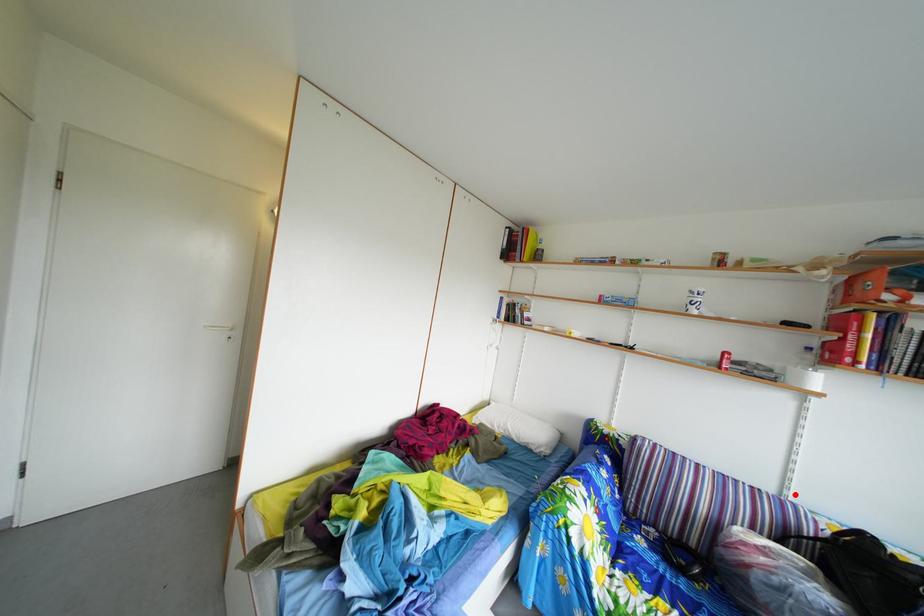
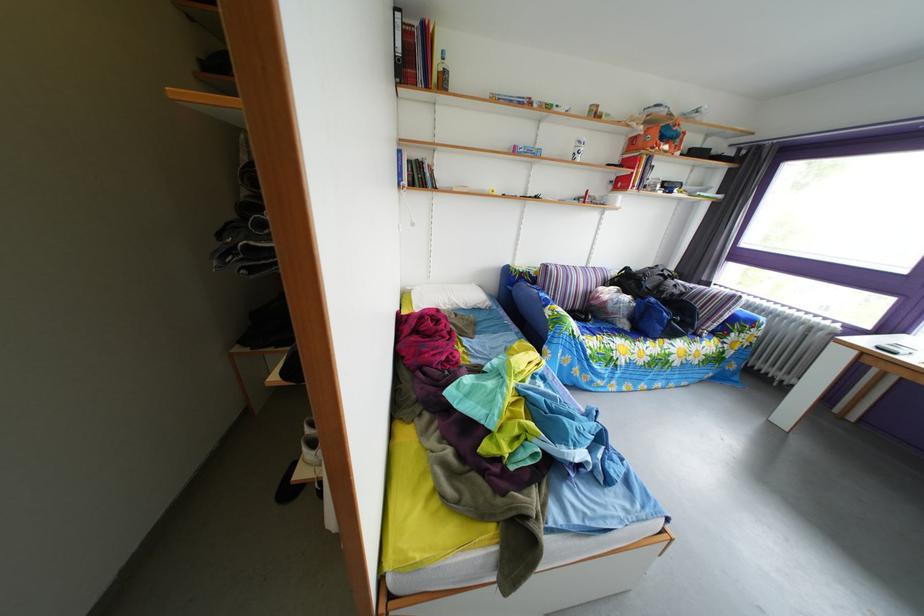
Find the pixel in the second image that matches the highlighted location in the first image.

(599, 270)